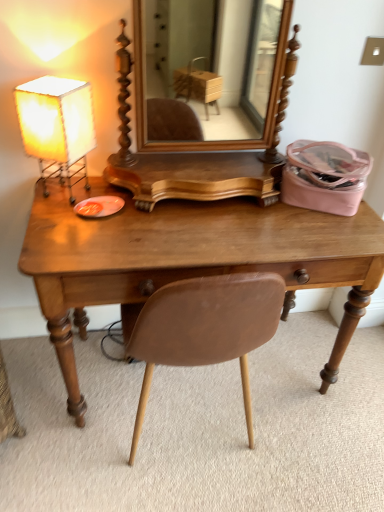
Question: Can you confirm if wooden desk at center is thinner than matte white lampshade at left?

Choices:
 (A) no
 (B) yes

Answer: (A)

Question: From a real-world perspective, is wooden desk at center under matte white lampshade at left?

Choices:
 (A) yes
 (B) no

Answer: (A)

Question: Are wooden desk at center and matte white lampshade at left located far from each other?

Choices:
 (A) no
 (B) yes

Answer: (A)

Question: Does wooden desk at center have a greater height compared to matte white lampshade at left?

Choices:
 (A) yes
 (B) no

Answer: (A)

Question: Can you confirm if wooden desk at center is wider than matte white lampshade at left?

Choices:
 (A) yes
 (B) no

Answer: (A)

Question: Is the position of wooden desk at center more distant than that of matte white lampshade at left?

Choices:
 (A) no
 (B) yes

Answer: (A)

Question: Can you confirm if matte white lampshade at left is bigger than wooden desk at center?

Choices:
 (A) yes
 (B) no

Answer: (B)

Question: Considering the relative sizes of matte white lampshade at left and wooden desk at center in the image provided, is matte white lampshade at left smaller than wooden desk at center?

Choices:
 (A) yes
 (B) no

Answer: (A)

Question: Is matte white lampshade at left facing away from wooden desk at center?

Choices:
 (A) no
 (B) yes

Answer: (A)

Question: Are matte white lampshade at left and wooden desk at center located far from each other?

Choices:
 (A) yes
 (B) no

Answer: (B)

Question: Is matte white lampshade at left located outside wooden desk at center?

Choices:
 (A) yes
 (B) no

Answer: (A)

Question: From the image's perspective, is matte white lampshade at left on top of wooden desk at center?

Choices:
 (A) yes
 (B) no

Answer: (A)

Question: Relative to matte white lampshade at left, is wooden desk at center in front or behind?

Choices:
 (A) behind
 (B) front

Answer: (B)